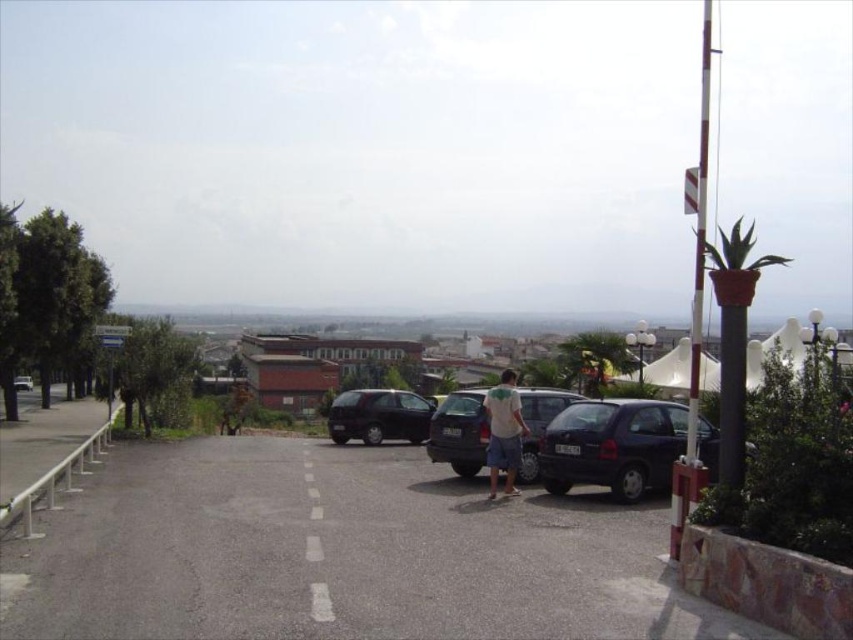
Question: Does dark gray metallic car at center come behind white cotton shirt at center?

Choices:
 (A) yes
 (B) no

Answer: (A)

Question: Estimate the real-world distances between objects in this image. Which object is closer to the dark gray matte van at center?

Choices:
 (A) gray asphalt parking lot at center
 (B) white cotton shirt at center
 (C) matte black van at left
 (D) dark gray metallic car at center

Answer: (D)

Question: Which of the following is the farthest from the observer?

Choices:
 (A) (115, 488)
 (B) (515, 435)
 (C) (28, 376)
 (D) (433, 416)

Answer: (C)

Question: Based on their relative distances, which object is nearer to the white cotton shirt at center?

Choices:
 (A) dark gray matte van at center
 (B) matte black van at left
 (C) dark blue matte car at center
 (D) dark gray metallic car at center

Answer: (D)

Question: Considering the relative positions of dark blue matte car at center and matte black van at left in the image provided, where is dark blue matte car at center located with respect to matte black van at left?

Choices:
 (A) left
 (B) right

Answer: (B)

Question: Does dark gray metallic car at center appear on the left side of dark gray matte van at center?

Choices:
 (A) yes
 (B) no

Answer: (B)